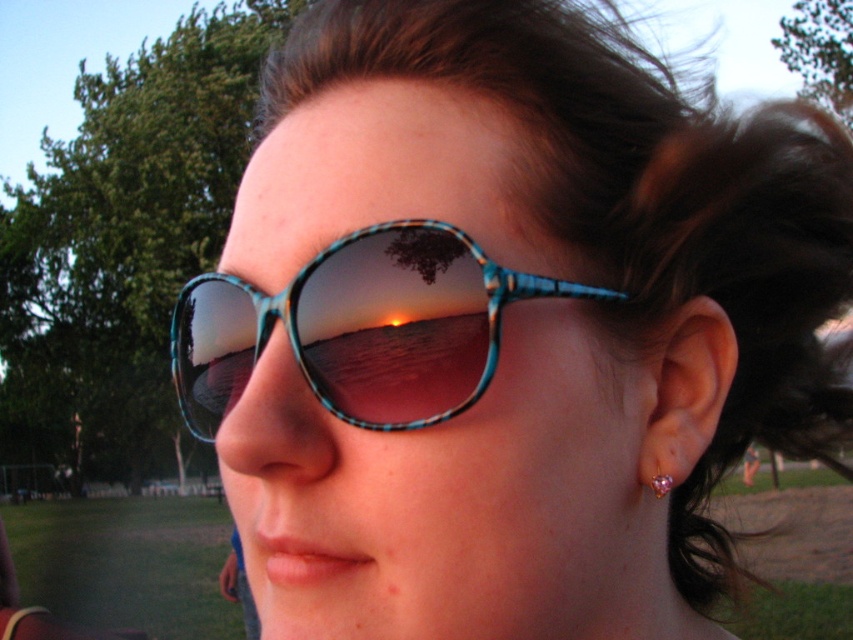
You are a photographer adjusting your camera to focus on the brown shiny hair at upper center and the pink gemstone earring at ear. Which object should you focus on first if you want to prioritize the one that is taller?

The brown shiny hair at upper center is taller than the pink gemstone earring at ear, so you should focus on the brown shiny hair at upper center first.

You are a photographer trying to capture the reflection of the sunset in the sunglasses. The point marked as point (645, 205) indicates the location of brown shiny hair at upper center. Where should you position your camera relative to this point to ensure the reflection of the sunset is visible in the sunglasses?

To capture the reflection of the sunset in the sunglasses, position your camera directly above the brown shiny hair at upper center marked by point (645, 205). This placement ensures the reflection from the sunset in the sky will reflect into the sunglasses lenses.

You are a photographer trying to capture the reflection of the sunset in the teal glossy sunglasses at center. Since the brown shiny hair at upper center might block the view, which object is bigger and could potentially cover more of the sunglasses?

The brown shiny hair at upper center is larger in size than the teal glossy sunglasses at center, so it could potentially cover more of the sunglasses.